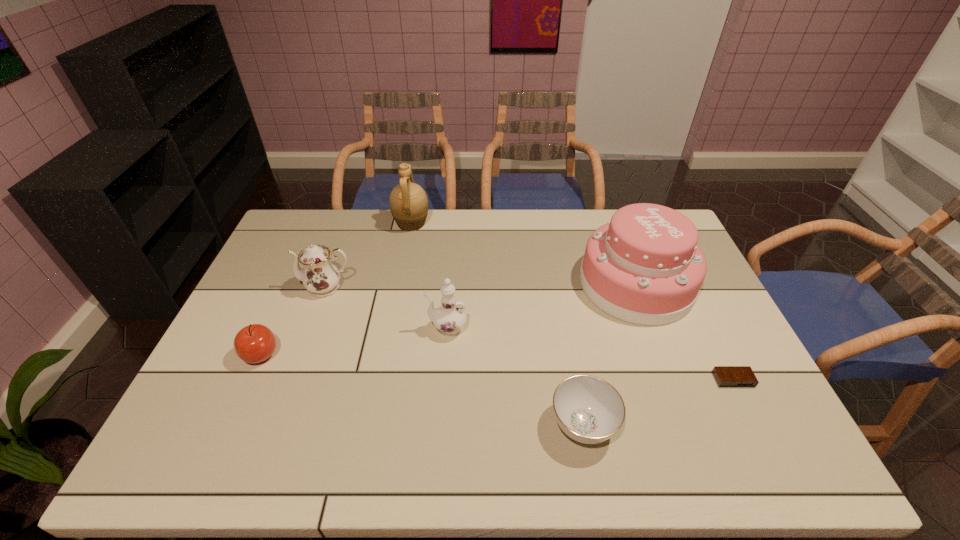
Find the location of `free space at the left edge of the desktop`. free space at the left edge of the desktop is located at coordinates (300, 266).

In the image, there is a desktop. Identify the location of free space at the right edge. (739, 364).

In the image, there is a desktop. Where is `vacant space at the far left corner`? The image size is (960, 540). vacant space at the far left corner is located at coordinates (291, 241).

This screenshot has width=960, height=540. In the image, there is a desktop. Identify the location of vacant area at the near left corner. (207, 441).

The width and height of the screenshot is (960, 540). I want to click on vacant region between the birthday cake and the nearest chinaware, so click(x=610, y=354).

This screenshot has height=540, width=960. I want to click on free space between the alarm clock and the farthest chinaware, so click(x=530, y=333).

Find the location of `empty space that is in between the leftmost chinaware and the fourth object from left to right`. empty space that is in between the leftmost chinaware and the fourth object from left to right is located at coordinates (386, 308).

Where is `empty space between the second chinaware from right to left and the leftmost chinaware`? empty space between the second chinaware from right to left and the leftmost chinaware is located at coordinates (386, 308).

Locate an element on the screen. This screenshot has height=540, width=960. empty space that is in between the leftmost chinaware and the birthday cake is located at coordinates (481, 286).

You are a GUI agent. You are given a task and a screenshot of the screen. Output one action in this format:
    pyautogui.click(x=<x>, y=<y>)
    Task: Click on the empty location between the nearest object and the third shortest object
    The width and height of the screenshot is (960, 540).
    Given the screenshot: What is the action you would take?
    pyautogui.click(x=421, y=390)